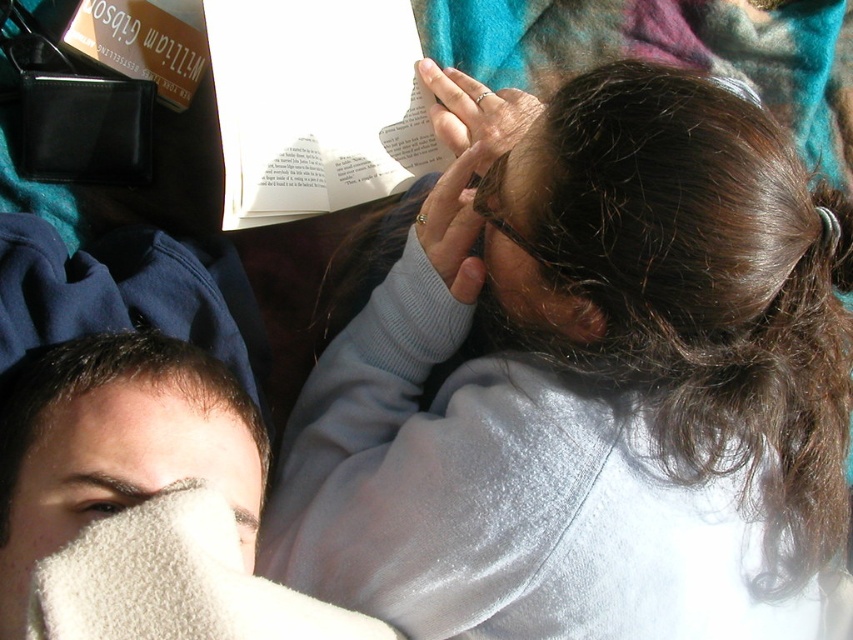
Question: Based on their relative distances, which object is farther from the white fuzzy cloth at lower left?

Choices:
 (A) matte silver ring at upper center
 (B) white paper at upper center

Answer: (A)

Question: Estimate the real-world distances between objects in this image. Which object is closer to the white paper at upper center?

Choices:
 (A) dry skin at upper left
 (B) white fuzzy cloth at lower left
 (C) matte silver ring at upper center

Answer: (C)

Question: In this image, where is light gray sweater at upper right located relative to matte gray sweater at upper center?

Choices:
 (A) left
 (B) right

Answer: (B)

Question: Can you confirm if white fuzzy cloth at lower left is wider than hardcover book at upper left?

Choices:
 (A) no
 (B) yes

Answer: (B)

Question: Does light gray sweater at upper right have a greater width compared to white fuzzy cloth at lower left?

Choices:
 (A) yes
 (B) no

Answer: (A)

Question: Which object is closer to the camera taking this photo?

Choices:
 (A) white fuzzy cloth at lower left
 (B) white paper at upper center
 (C) matte silver ring at upper center
 (D) hardcover book at upper left

Answer: (A)